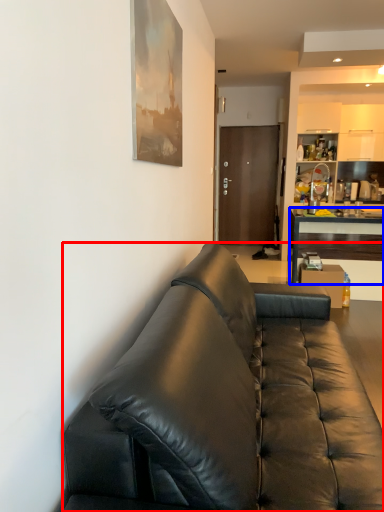
Question: Which object appears farthest to the camera in this image, studio couch (highlighted by a red box) or desk (highlighted by a blue box)?

Choices:
 (A) studio couch
 (B) desk

Answer: (B)